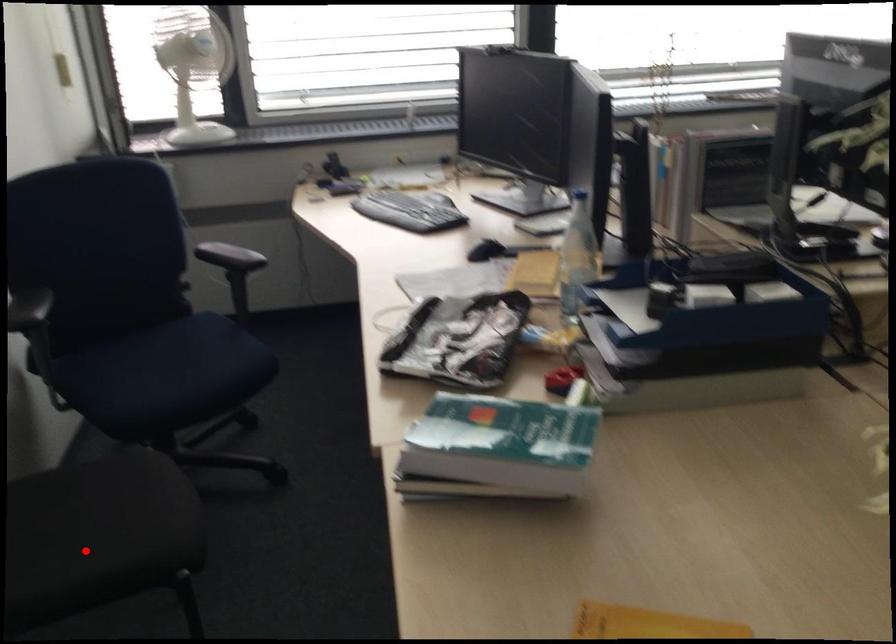
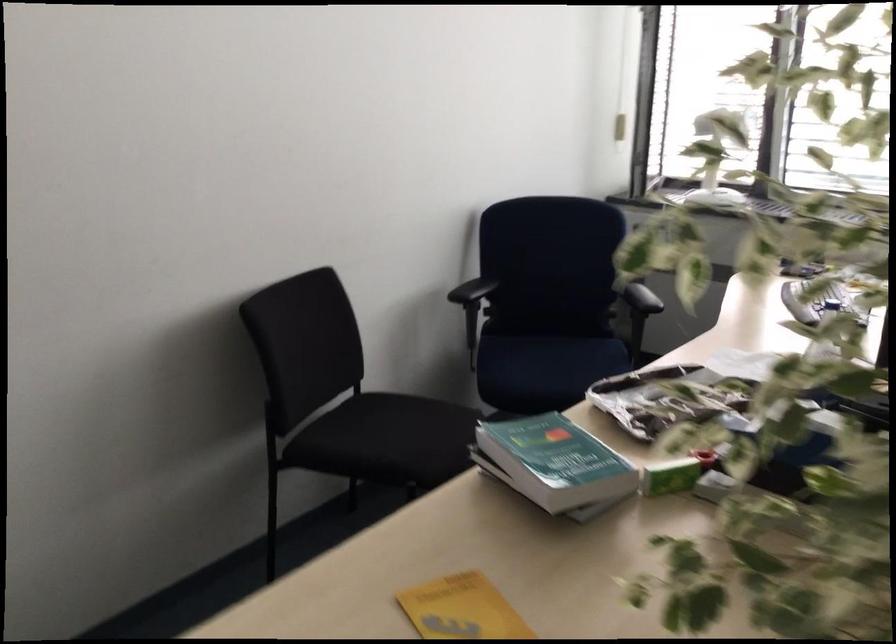
Find the pixel in the second image that matches the highlighted location in the first image.

(377, 436)